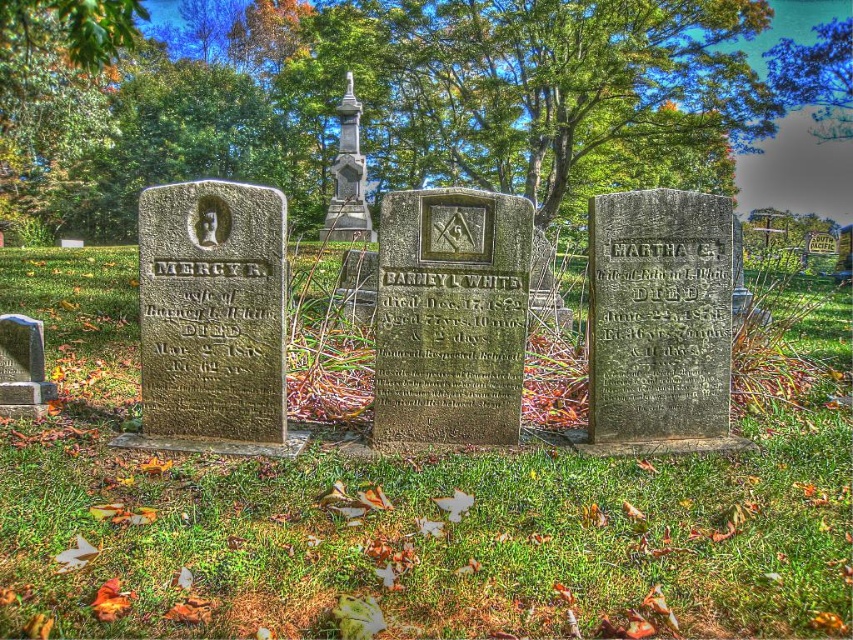
Question: Can you confirm if green stone gravestone at left is smaller than green leafy tree at upper center?

Choices:
 (A) yes
 (B) no

Answer: (A)

Question: Which object is positioned farthest from the granite gravestone at center?

Choices:
 (A) green grass at center
 (B) green leafy tree at upper center
 (C) dark gray stone gravestone at right
 (D) green stone gravestone at left

Answer: (B)

Question: Estimate the real-world distances between objects in this image. Which object is closer to the granite gravestone at center?

Choices:
 (A) green stone gravestone at left
 (B) green leafy tree at upper center

Answer: (A)

Question: Does green grass at center have a lesser width compared to green stone gravestone at left?

Choices:
 (A) no
 (B) yes

Answer: (A)

Question: Is granite gravestone at center smaller than dark gray stone gravestone at right?

Choices:
 (A) yes
 (B) no

Answer: (B)

Question: Which point is farther to the camera?

Choices:
 (A) polished stone monument at center
 (B) green leafy tree at upper center

Answer: (B)